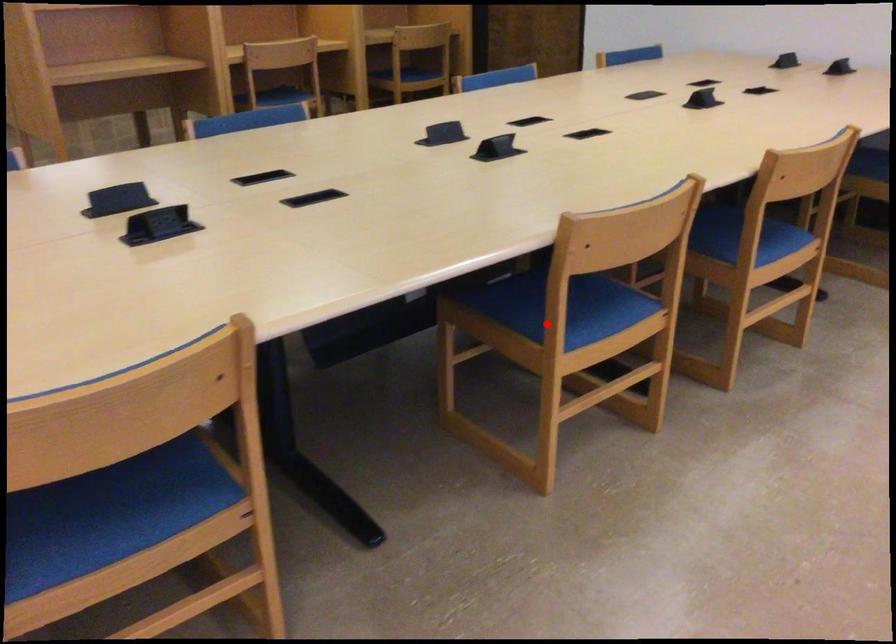
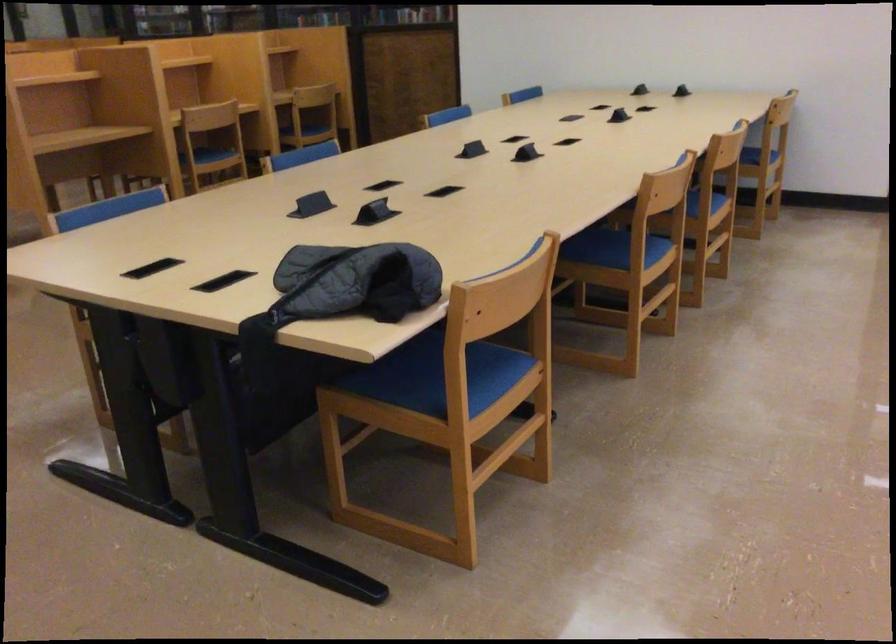
Question: I am providing you with two images of the same scene from different viewpoints. Given a red point in image1, look at the same physical point in image2. Is it:

Choices:
 (A) Closer to the viewpoint
 (B) Farther from the viewpoint

Answer: (B)